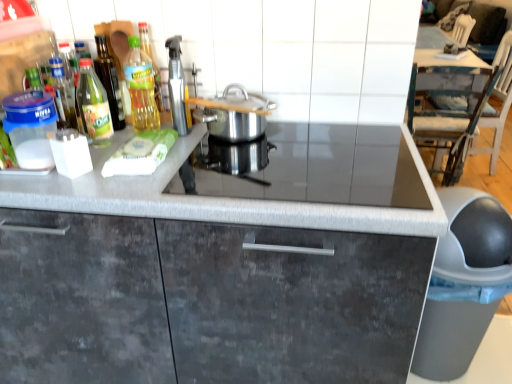
Find the location of a particular element. free space in front of green glass bottle at left, the first kitchen appliance viewed from the left is located at coordinates (75, 178).